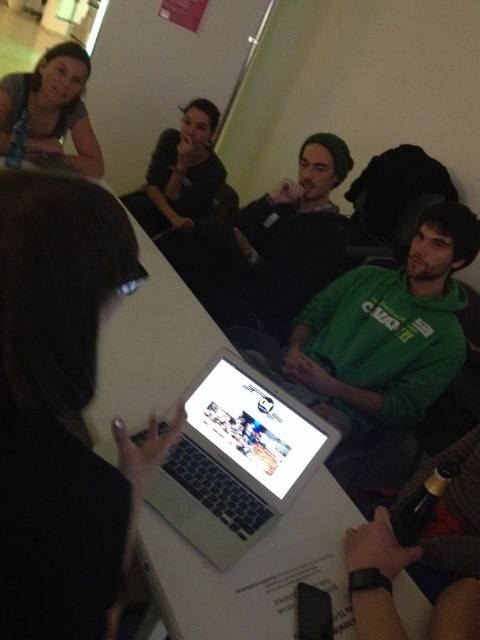
You are a guest at the gathering and want to place a small notebook on the table. Considering the silver metallic laptop at center is already on the white glossy table at center, where should you place the notebook to ensure it is visible to everyone around the table?

Place the notebook on the white glossy table at center but away from the silver metallic laptop at center so it remains visible to all attendees.

You are a guest at the gathering and want to place a small notebook on the table without covering the laptop. Can you fit it next to the silver metallic laptop at center on the white glossy table at center?

The white glossy table at center is taller than the silver metallic laptop at center, meaning there is enough vertical space to place the notebook next to the laptop on the table. However, the description does not provide information about the horizontal dimensions of the table or the laptop, so we cannot confirm if there is enough horizontal space.

You are organizing a presentation and need to place a name tag on the silver metallic laptop at center and the matte gray shirt at upper left. Which object requires a larger name tag?

The matte gray shirt at upper left requires a larger name tag because it is bigger than the silver metallic laptop at center.